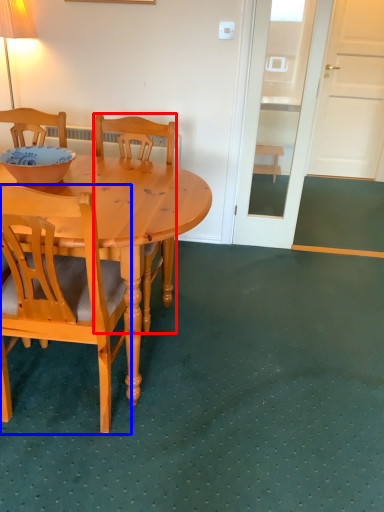
Question: Which object is further to the camera taking this photo, chair (highlighted by a red box) or chair (highlighted by a blue box)?

Choices:
 (A) chair
 (B) chair

Answer: (A)